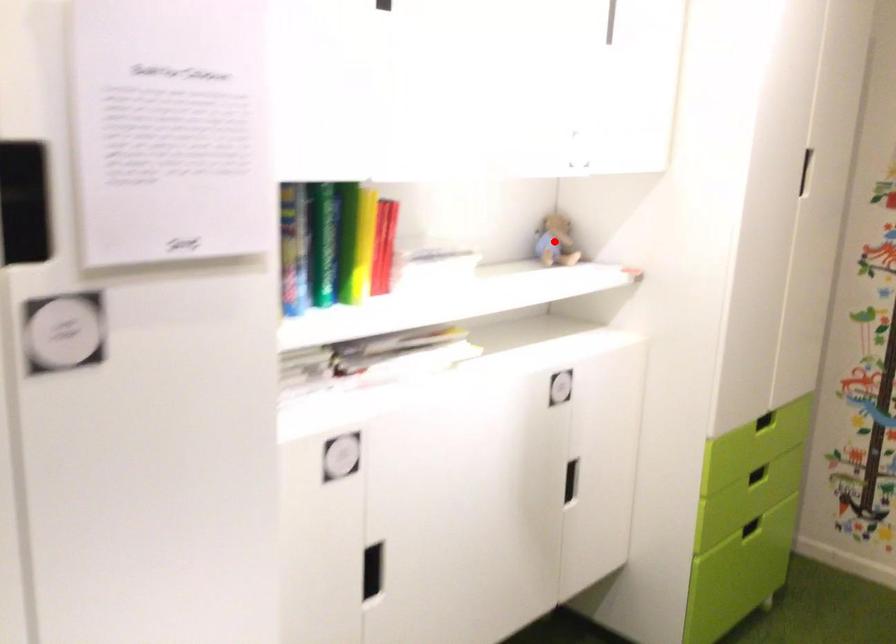
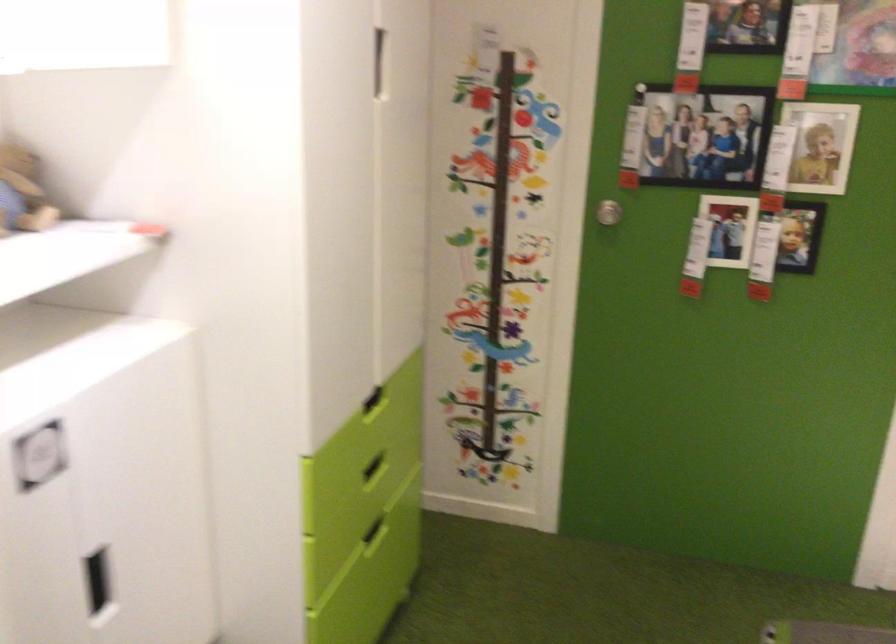
In the second image, find the point that corresponds to the highlighted location in the first image.

(22, 192)